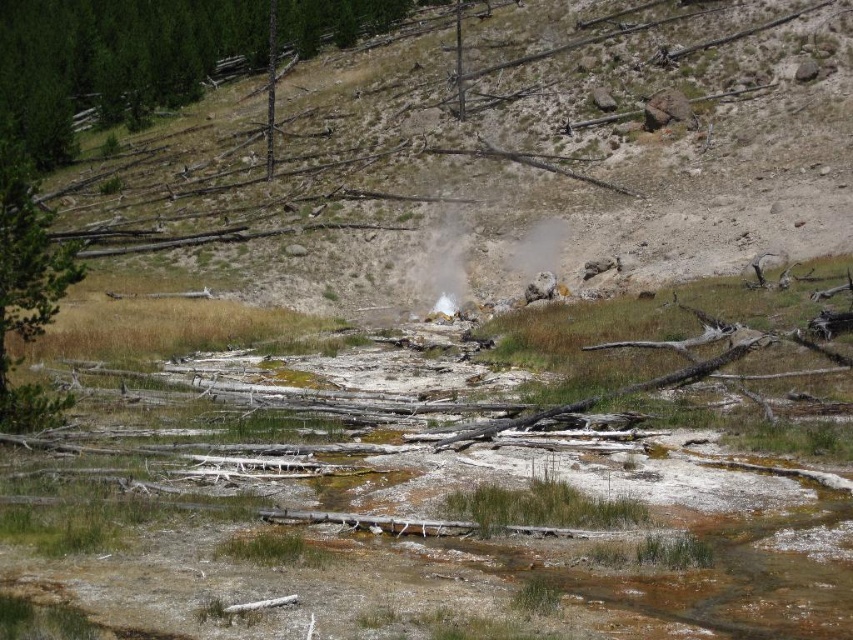
Based on the photo, you are a hiker trying to determine the tallest object in this geothermal area. Which is taller between the green rough bark tree at left and the white vapor at center?

The green rough bark tree at left is taller than the white vapor at center, so the tallest object is the green rough bark tree at left.

You are standing at the edge of the geothermal area and want to collect a dull yellowish rock at center. If you have a 25 meter long rope, can you reach the rock without moving closer?

The dull yellowish rock at center is 25.01 meters away from the viewer. Since the rope is only 25 meters long, it is 1 centimeter too short to reach the rock without moving closer.

In the scene shown: You are a geologist examining the landscape. You notice the dull yellowish rock at center and the green rough bark tree at left. Which object is taller?

The dull yellowish rock at center is much taller than the green rough bark tree at left.